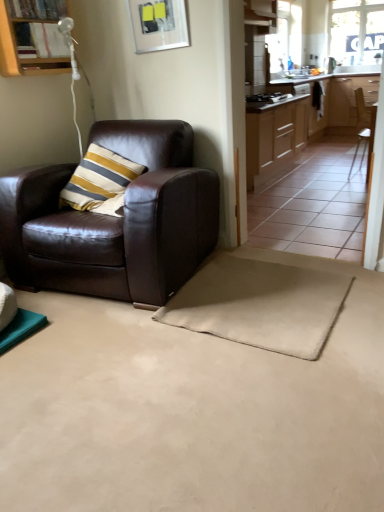
Question: Considering the relative sizes of wooden cabinet at upper left, which ranks as the 1th cabinetry in left-to-right order, and transparent glass window at upper right in the image provided, is wooden cabinet at upper left, which ranks as the 1th cabinetry in left-to-right order, thinner than transparent glass window at upper right?

Choices:
 (A) no
 (B) yes

Answer: (A)

Question: Is wooden cabinet at upper left, the third cabinetry when ordered from back to front, positioned behind transparent glass window at upper right?

Choices:
 (A) yes
 (B) no

Answer: (B)

Question: From a real-world perspective, is wooden cabinet at upper left, the third cabinetry when ordered from back to front, on transparent glass window at upper right?

Choices:
 (A) yes
 (B) no

Answer: (B)

Question: Is wooden cabinet at upper left, which appears as the 1th cabinetry when viewed from the front, not close to transparent glass window at upper right?

Choices:
 (A) yes
 (B) no

Answer: (A)

Question: Is wooden cabinet at upper left, which is the 3th cabinetry from right to left, positioned with its back to transparent glass window at upper right?

Choices:
 (A) no
 (B) yes

Answer: (A)

Question: Would you say white glossy sink at upper center is inside or outside brown leather chair at right, the 1th chair positioned from the back?

Choices:
 (A) inside
 (B) outside

Answer: (B)

Question: From the image's perspective, relative to brown leather chair at right, the 1th chair positioned from the back, is white glossy sink at upper center above or below?

Choices:
 (A) above
 (B) below

Answer: (A)

Question: Is white glossy sink at upper center taller or shorter than brown leather chair at right, which is the first chair in top-to-bottom order?

Choices:
 (A) tall
 (B) short

Answer: (B)

Question: In terms of width, does white glossy sink at upper center look wider or thinner when compared to brown leather chair at right, which is the 2th chair from left to right?

Choices:
 (A) thin
 (B) wide

Answer: (B)

Question: Do you think brown leather chair at right, the 1th chair positioned from the back, is within light wood cabinetry at center, the first cabinetry when ordered from right to left, or outside of it?

Choices:
 (A) outside
 (B) inside

Answer: (A)

Question: Is point (369, 117) closer or farther from the camera than point (332, 91)?

Choices:
 (A) closer
 (B) farther

Answer: (A)

Question: In terms of width, does brown leather chair at right, which is the first chair in top-to-bottom order, look wider or thinner when compared to light wood cabinetry at center, the first cabinetry when ordered from back to front?

Choices:
 (A) thin
 (B) wide

Answer: (A)

Question: From the image's perspective, is brown leather chair at right, which is the first chair in top-to-bottom order, located above or below light wood cabinetry at center, which ranks as the third cabinetry in left-to-right order?

Choices:
 (A) above
 (B) below

Answer: (B)

Question: Is point (139, 37) positioned closer to the camera than point (31, 61)?

Choices:
 (A) farther
 (B) closer

Answer: (A)

Question: Considering their positions, is metallic silver picture frame at upper center located in front of or behind wooden cabinet at upper left, which ranks as the 1th cabinetry in left-to-right order?

Choices:
 (A) front
 (B) behind

Answer: (B)